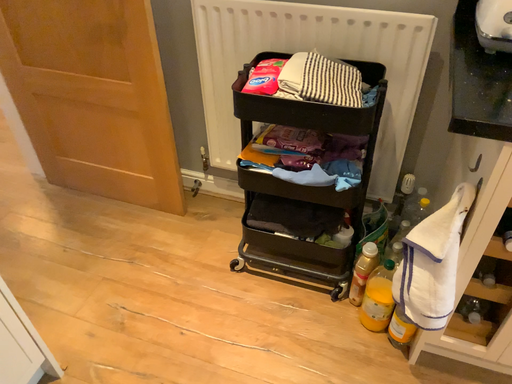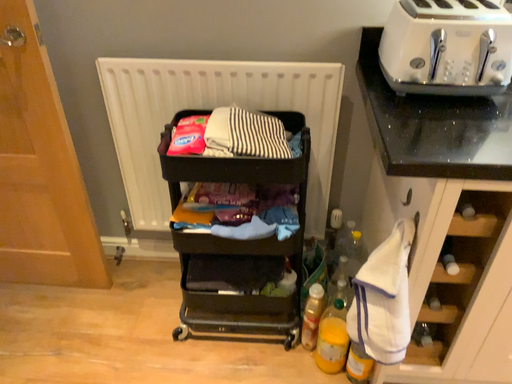
Question: How did the camera likely rotate when shooting the video?

Choices:
 (A) rotated left
 (B) rotated right

Answer: (B)